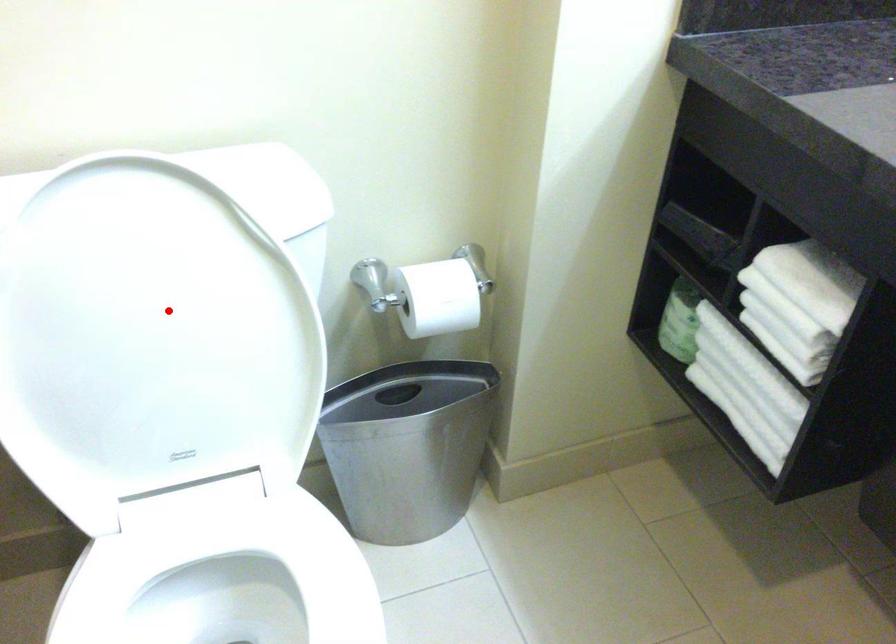
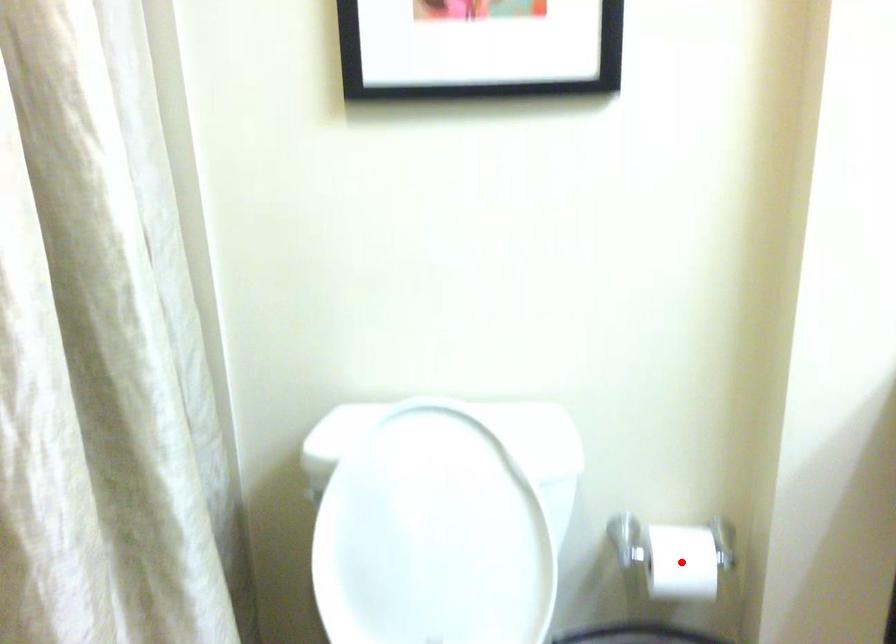
I am providing you with two images of the same scene from different viewpoints. A red point is marked on the first image and another point is marked on the second image. Is the marked point in image1 the same physical position as the marked point in image2?

No